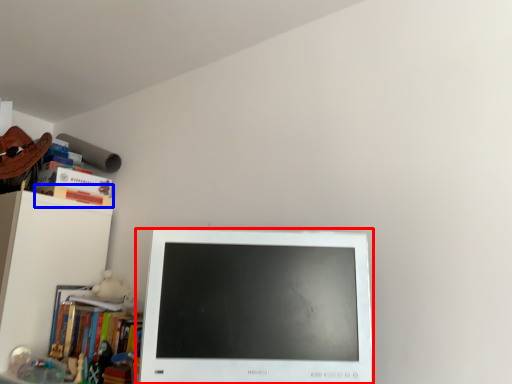
Question: Which object is further to the camera taking this photo, computer monitor (highlighted by a red box) or paperback book (highlighted by a blue box)?

Choices:
 (A) computer monitor
 (B) paperback book

Answer: (B)